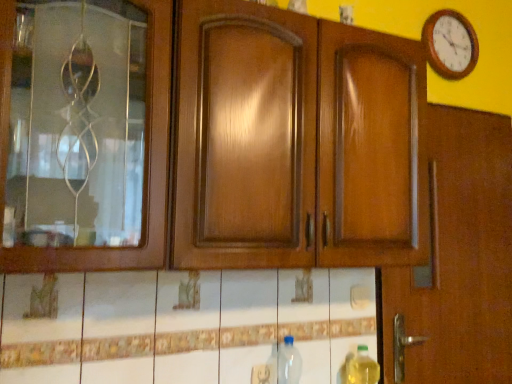
Question: Considering the relative sizes of wooden clock at upper right and yellow translucent bottle at lower right, arranged as the first bottle when viewed from the right, in the image provided, is wooden clock at upper right bigger than yellow translucent bottle at lower right, arranged as the first bottle when viewed from the right,?

Choices:
 (A) yes
 (B) no

Answer: (A)

Question: Can you confirm if wooden clock at upper right is thinner than yellow translucent bottle at lower right, arranged as the first bottle when viewed from the right?

Choices:
 (A) yes
 (B) no

Answer: (A)

Question: Could you tell me if wooden clock at upper right is facing yellow translucent bottle at lower right, which is the second bottle from left to right?

Choices:
 (A) yes
 (B) no

Answer: (B)

Question: Considering the relative positions of wooden clock at upper right and yellow translucent bottle at lower right, arranged as the first bottle when viewed from the right, in the image provided, is wooden clock at upper right to the left of yellow translucent bottle at lower right, arranged as the first bottle when viewed from the right, from the viewer's perspective?

Choices:
 (A) yes
 (B) no

Answer: (B)

Question: Is wooden clock at upper right to the right of yellow translucent bottle at lower right, arranged as the first bottle when viewed from the right, from the viewer's perspective?

Choices:
 (A) yes
 (B) no

Answer: (A)

Question: From a real-world perspective, is transparent plastic bottle at lower center, arranged as the first bottle when viewed from the left, physically located above or below yellow translucent bottle at lower right, arranged as the first bottle when viewed from the right?

Choices:
 (A) below
 (B) above

Answer: (B)

Question: Is transparent plastic bottle at lower center, which is counted as the 2th bottle, starting from the right, wider or thinner than yellow translucent bottle at lower right, which is the second bottle from left to right?

Choices:
 (A) wide
 (B) thin

Answer: (A)

Question: In terms of size, does transparent plastic bottle at lower center, which is counted as the 2th bottle, starting from the right, appear bigger or smaller than yellow translucent bottle at lower right, which is the second bottle from left to right?

Choices:
 (A) small
 (B) big

Answer: (B)

Question: Do you think transparent plastic bottle at lower center, arranged as the first bottle when viewed from the left, is within yellow translucent bottle at lower right, arranged as the first bottle when viewed from the right, or outside of it?

Choices:
 (A) outside
 (B) inside

Answer: (A)

Question: From the image's perspective, relative to yellow translucent bottle at lower right, which is the second bottle from left to right, is wooden clock at upper right above or below?

Choices:
 (A) below
 (B) above

Answer: (B)

Question: Is wooden clock at upper right to the left or to the right of yellow translucent bottle at lower right, arranged as the first bottle when viewed from the right, in the image?

Choices:
 (A) left
 (B) right

Answer: (B)

Question: From their relative heights in the image, would you say wooden clock at upper right is taller or shorter than yellow translucent bottle at lower right, arranged as the first bottle when viewed from the right?

Choices:
 (A) short
 (B) tall

Answer: (B)

Question: Relative to yellow translucent bottle at lower right, which is the second bottle from left to right, is wooden clock at upper right in front or behind?

Choices:
 (A) front
 (B) behind

Answer: (B)

Question: Looking at their shapes, would you say wooden clock at upper right is wider or thinner than transparent plastic bottle at lower center, arranged as the first bottle when viewed from the left?

Choices:
 (A) thin
 (B) wide

Answer: (A)

Question: In the image, is wooden clock at upper right positioned in front of or behind transparent plastic bottle at lower center, which is counted as the 2th bottle, starting from the right?

Choices:
 (A) behind
 (B) front

Answer: (A)